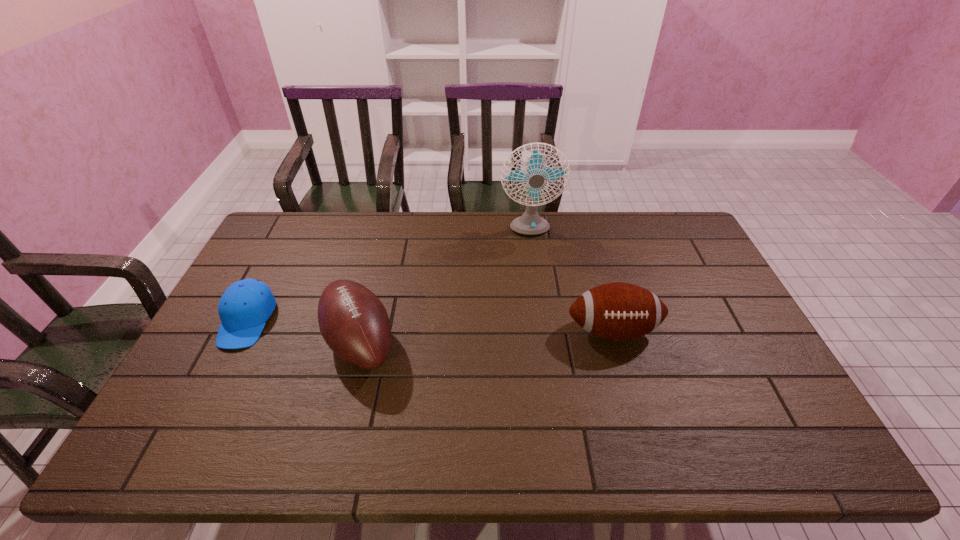
Locate an element on the screen. vacant region between the farthest object and the left football is located at coordinates (444, 287).

Locate an element on the screen. The width and height of the screenshot is (960, 540). vacant space in between the second object from left to right and the cap is located at coordinates (303, 332).

Identify the location of free space that is in between the farthest object and the leftmost object. The height and width of the screenshot is (540, 960). (388, 276).

I want to click on vacant area that lies between the left football and the cap, so click(x=303, y=332).

The image size is (960, 540). Identify the location of vacant area between the leftmost object and the third object from right to left. (303, 332).

Identify the location of free space between the farthest object and the second object from left to right. The height and width of the screenshot is (540, 960). (444, 287).

What are the coordinates of `empty space between the right football and the fan` in the screenshot? It's located at (570, 281).

This screenshot has width=960, height=540. I want to click on free space between the shortest object and the left football, so click(303, 332).

Locate an element on the screen. The image size is (960, 540). object that is the third closest one to the fan is located at coordinates (245, 306).

Identify which object is located as the nearest to the leftmost object. Please provide its 2D coordinates. Your answer should be formatted as a tuple, i.e. [(x, y)], where the tuple contains the x and y coordinates of a point satisfying the conditions above.

[(354, 323)]